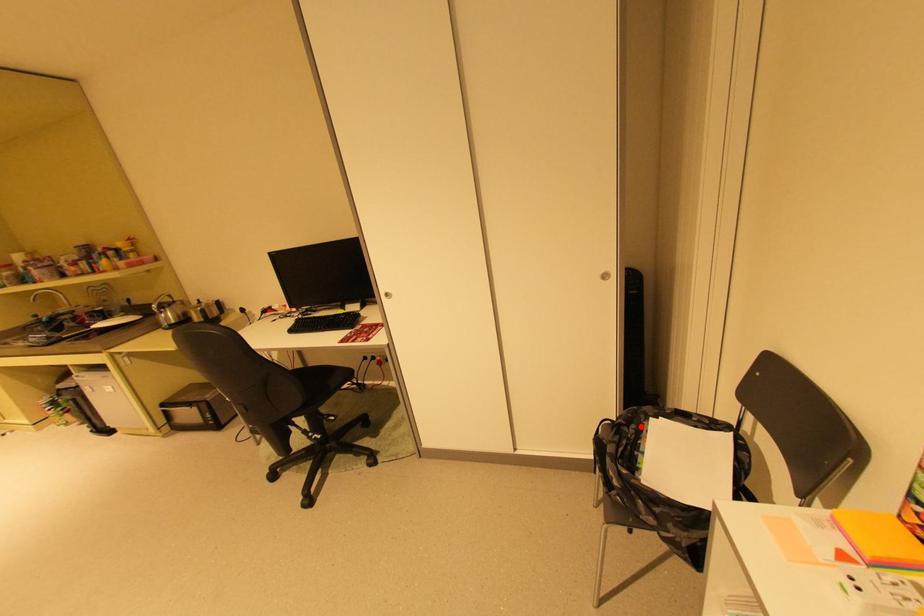
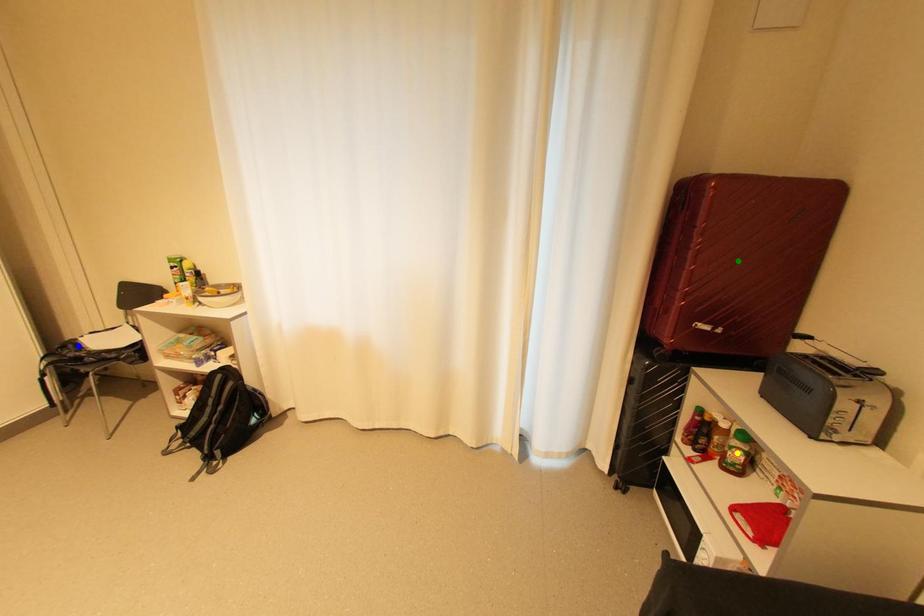
Question: I am providing you with two images of the same scene from different viewpoints. A red point is marked on the first image. You are given multiple points on the second image. In image 2, which mark is for the same physical point as the one in image 1?

Choices:
 (A) yellow point
 (B) green point
 (C) blue point

Answer: (C)